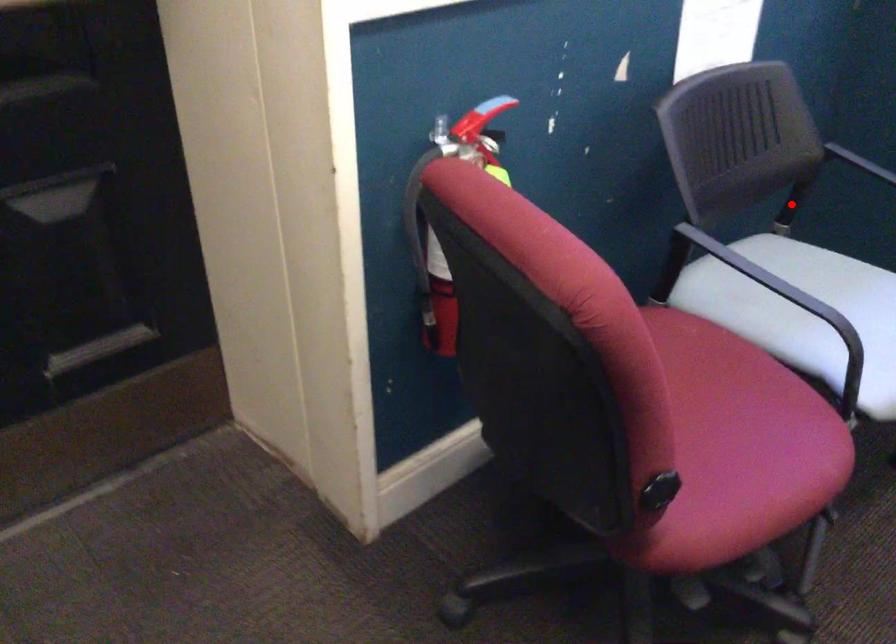
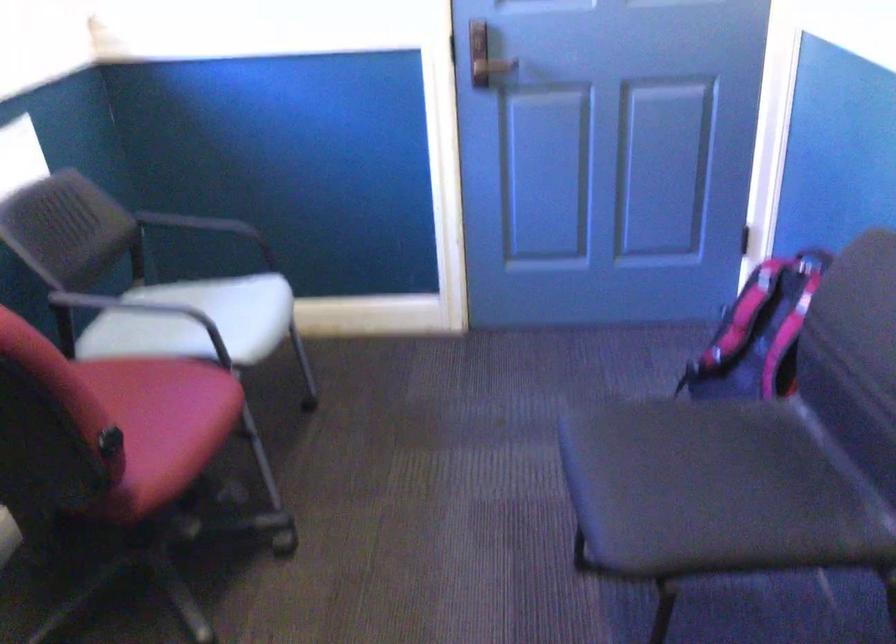
Find the pixel in the second image that matches the highlighted location in the first image.

(145, 265)